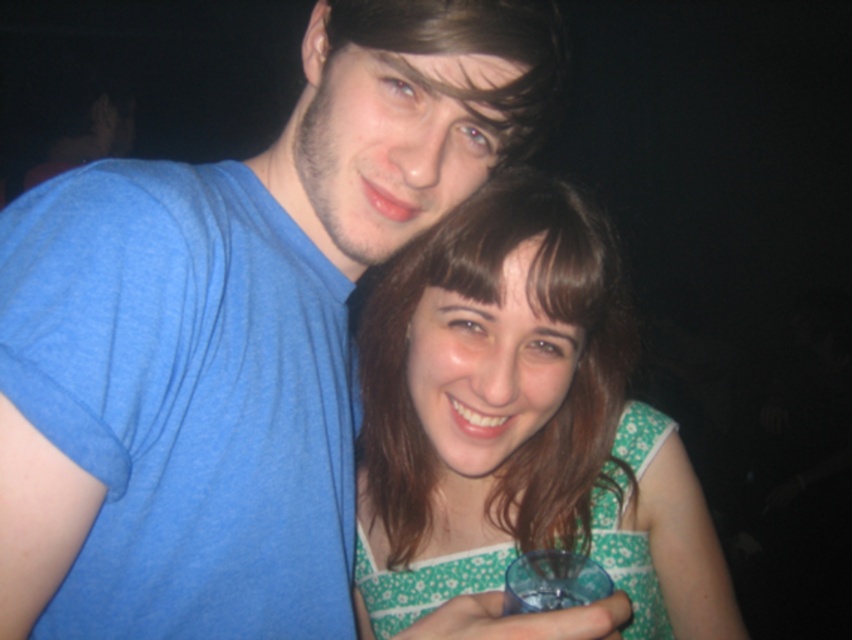
In the scene shown: Which is more to the right, blue cotton t-shirt at upper left or green floral dress at center?

green floral dress at center is more to the right.

Does blue cotton t-shirt at upper left have a smaller size compared to green floral dress at center?

No, blue cotton t-shirt at upper left is not smaller than green floral dress at center.

Between point (298, 586) and point (602, 342), which one is positioned behind?

The point (602, 342) is more distant.

This screenshot has width=852, height=640. What are the coordinates of `blue cotton t-shirt at upper left` in the screenshot? It's located at (246, 326).